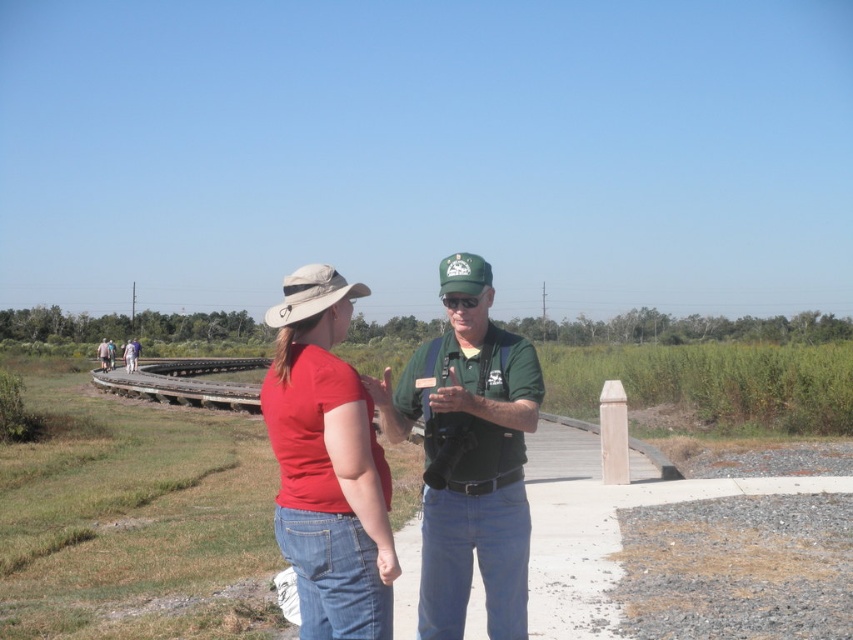
Between matte red shirt at center and green fabric baseball cap at center, which one is positioned higher?

Positioned higher is green fabric baseball cap at center.

Between matte red shirt at center and green fabric baseball cap at center, which one has more height?

matte red shirt at center

Between point (357, 582) and point (461, 280), which one is positioned in front?

Positioned in front is point (357, 582).

Locate an element on the screen. Image resolution: width=853 pixels, height=640 pixels. matte red shirt at center is located at coordinates (328, 465).

Which is below, khaki fabric baseball hat at center or matte red shirt at left?

matte red shirt at left is lower down.

Between khaki fabric baseball hat at center and matte red shirt at left, which one is positioned higher?

khaki fabric baseball hat at center is above.

Is point (321, 273) more distant than point (123, 348)?

No, (321, 273) is in front of (123, 348).

Find the location of a particular element. Image resolution: width=853 pixels, height=640 pixels. khaki fabric baseball hat at center is located at coordinates (311, 294).

Who is positioned more to the left, green fabric shirt at center or matte red shirt at left?

From the viewer's perspective, matte red shirt at left appears more on the left side.

Between green fabric shirt at center and matte red shirt at left, which one appears on the right side from the viewer's perspective?

green fabric shirt at center

Between point (483, 349) and point (128, 348), which one is positioned behind?

The point (128, 348) is more distant.

The width and height of the screenshot is (853, 640). Identify the location of green fabric shirt at center. (469, 465).